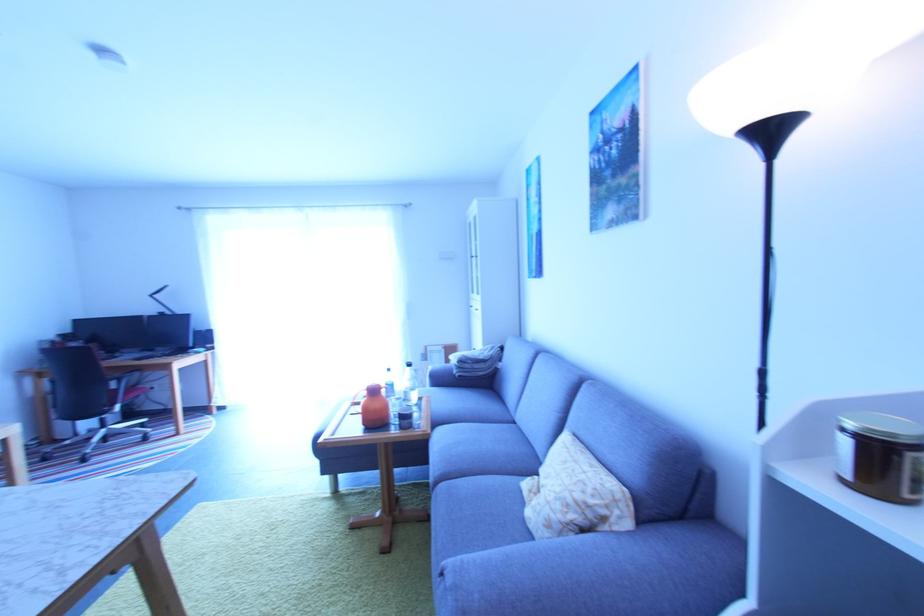
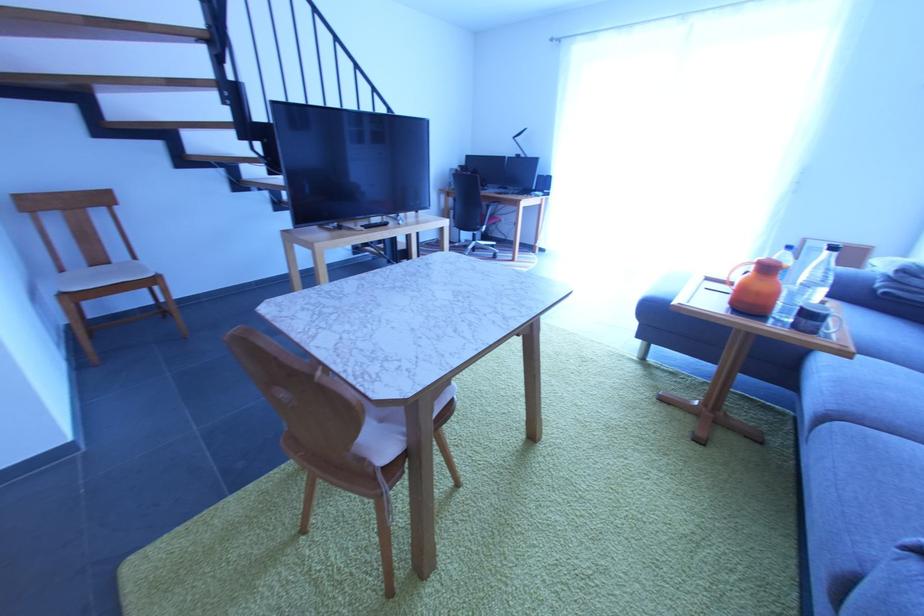
How did the camera likely rotate?

The rotation direction of the camera is left-down.